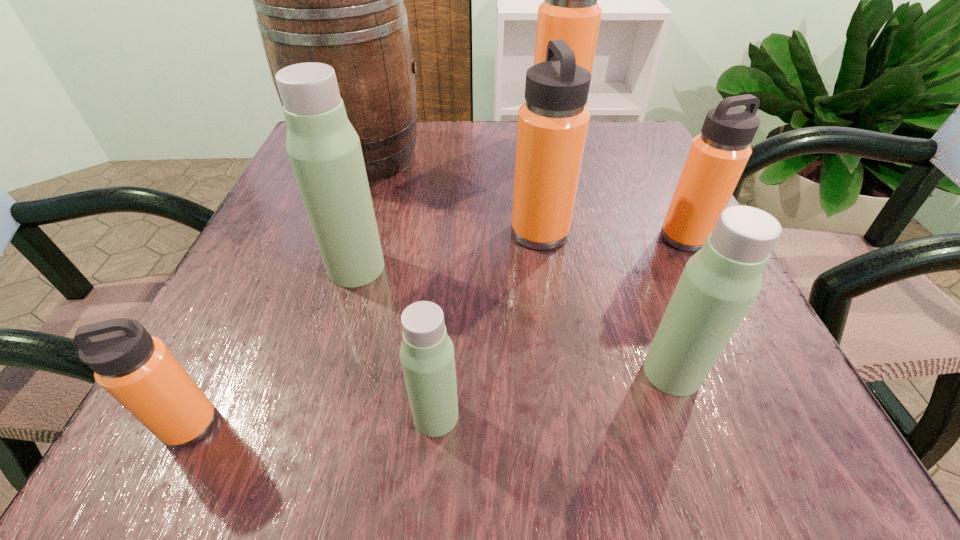
You are a GUI agent. You are given a task and a screenshot of the screen. Output one action in this format:
    pyautogui.click(x=<x>, y=<y>)
    Task: Click on the vacant space located on the back of the leftmost orange thermos bottle
    Image resolution: width=960 pixels, height=540 pixels.
    Given the screenshot: What is the action you would take?
    pyautogui.click(x=223, y=360)

Locate an element on the screen. Image resolution: width=960 pixels, height=540 pixels. thermos bottle located in the far edge section of the desktop is located at coordinates (570, 12).

The width and height of the screenshot is (960, 540). I want to click on cider that is at the far edge, so click(338, 0).

The height and width of the screenshot is (540, 960). Find the location of `cider present at the left edge`. cider present at the left edge is located at coordinates (338, 0).

In order to click on object located in the far left corner section of the desktop in this screenshot , I will do `click(338, 0)`.

This screenshot has width=960, height=540. I want to click on object that is positioned at the near left corner, so click(x=138, y=370).

Locate an element on the screen. This screenshot has width=960, height=540. object present at the far right corner is located at coordinates [570, 12].

Locate an element on the screen. object at the near right corner is located at coordinates (719, 283).

Where is `free space at the far edge of the desktop`? Image resolution: width=960 pixels, height=540 pixels. free space at the far edge of the desktop is located at coordinates (487, 177).

You are a GUI agent. You are given a task and a screenshot of the screen. Output one action in this format:
    pyautogui.click(x=<x>, y=<y>)
    Task: Click on the free space at the left edge of the desktop
    The width and height of the screenshot is (960, 540).
    Given the screenshot: What is the action you would take?
    pyautogui.click(x=264, y=342)